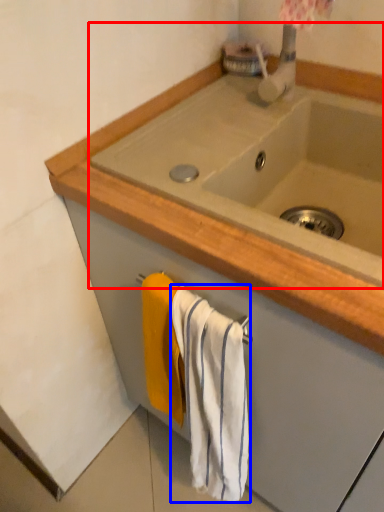
Question: Which of the following is the closest to the observer, sink (highlighted by a red box) or bath towel (highlighted by a blue box)?

Choices:
 (A) sink
 (B) bath towel

Answer: (A)